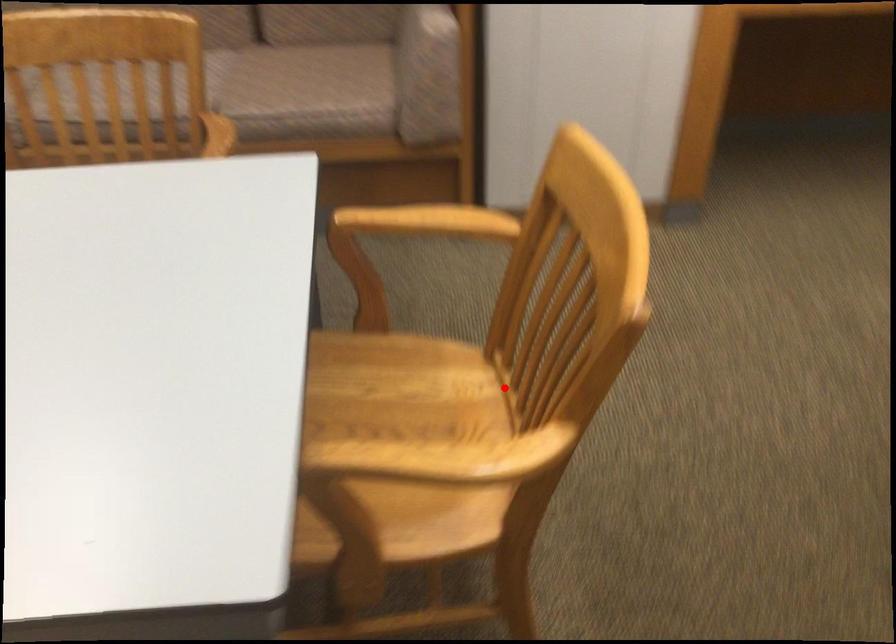
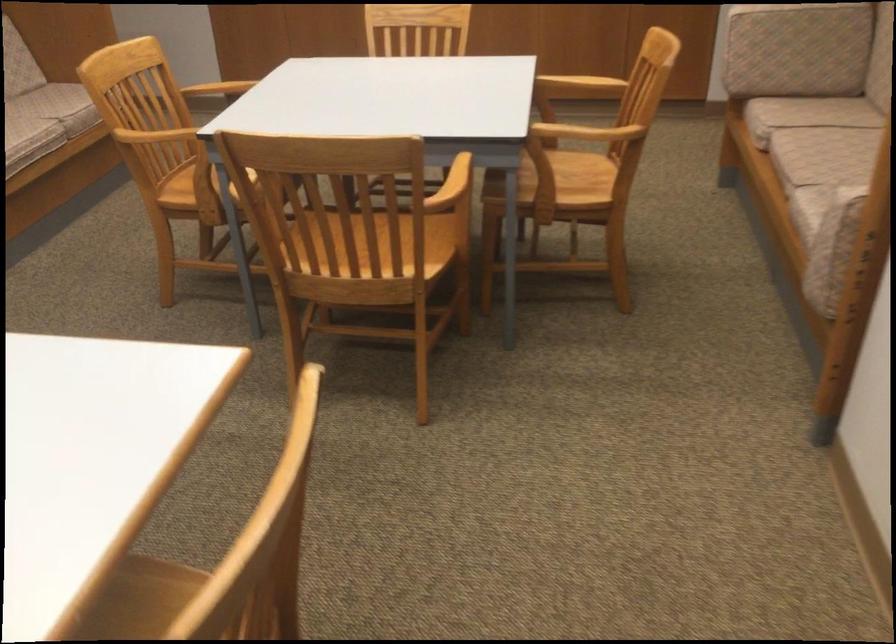
Find the pixel in the second image that matches the highlighted location in the first image.

(358, 259)